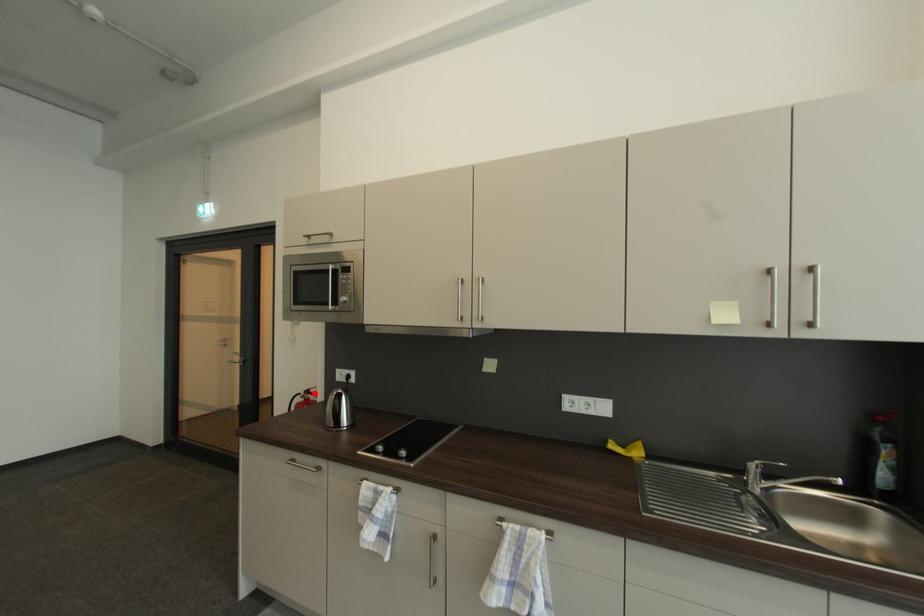
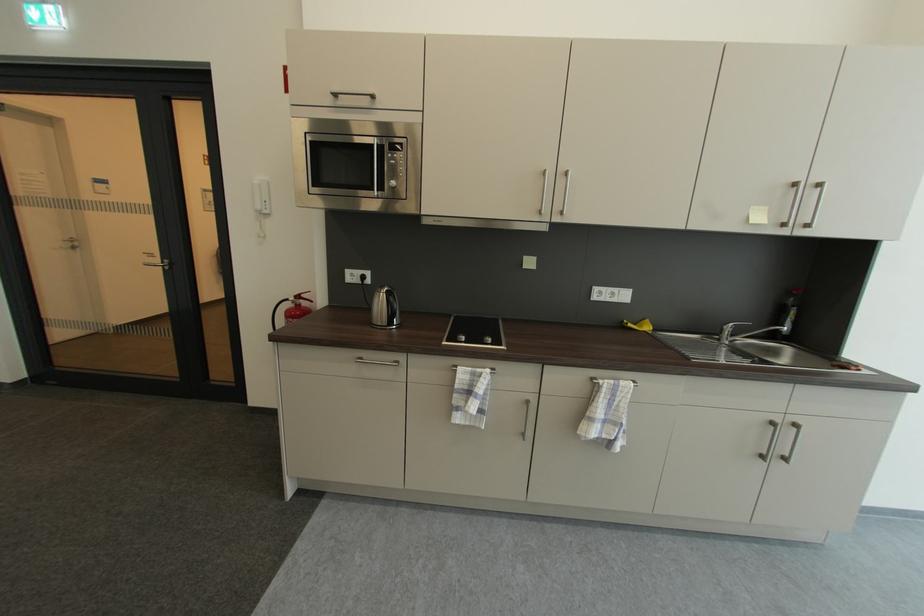
Where in the second image is the point corresponding to the highlighted location from the first image?

(305, 299)